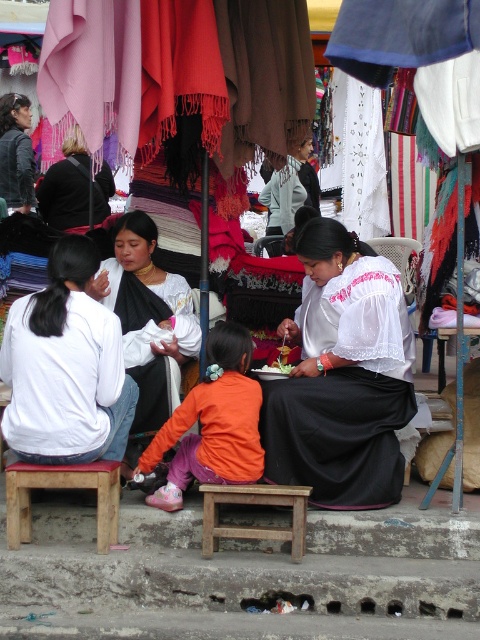
You are a visitor at the market and want to sit down next to the woman in the white lace blouse at center. Where is the light brown wooden stool at lower left located in relation to her?

The light brown wooden stool at lower left is behind the white lace blouse at center, so it is located behind her.

In the scene shown: You are a customer at the market and want to sit on the light brown wooden stool at lower left. To do so, you need to walk around the black woven fabric at center. Which direction should you go to avoid the fabric?

The black woven fabric at center is to the right of the light brown wooden stool at lower left. To avoid it, walk to the left side of the fabric.

You are standing at the market and want to reach the point marked as point (35, 333). The market has a narrow pathway that is 10 feet wide. Can you walk directly to the point without stepping into the vendor stalls?

The distance between you and point (35, 333) is 15.73 feet. Since the pathway is 10 feet wide, you can walk directly to the point as long as you stay within the pathway and avoid the vendor stalls.